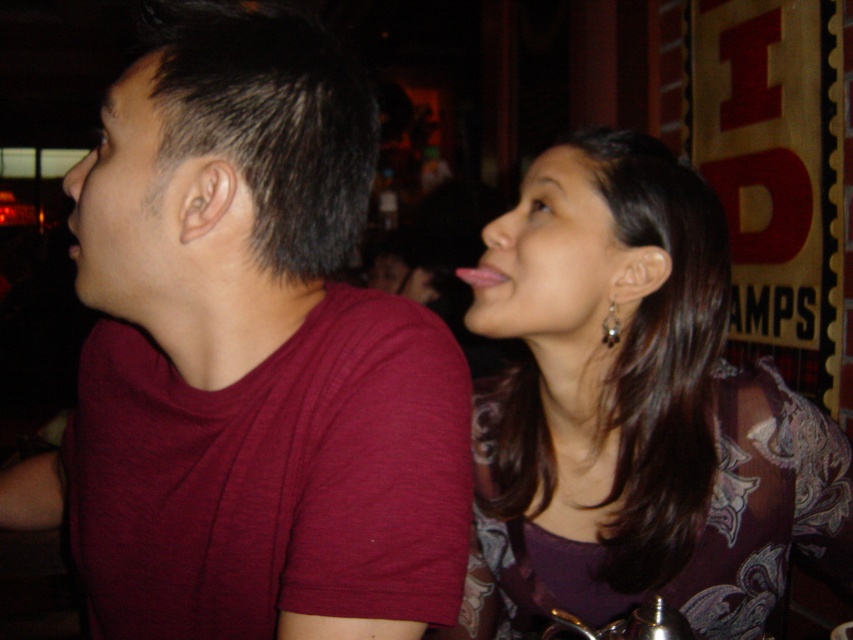
Question: Among these points, which one is farthest from the camera?

Choices:
 (A) click(x=602, y=330)
 (B) click(x=677, y=525)

Answer: (A)

Question: Which object is farther from the camera taking this photo?

Choices:
 (A) silver metallic earring at upper right
 (B) matte purple blouse at upper right
 (C) maroon t-shirt at left

Answer: (A)

Question: Which of the following is the closest to the observer?

Choices:
 (A) matte purple blouse at upper right
 (B) silver metallic earring at upper right

Answer: (A)

Question: Does maroon t-shirt at left have a smaller size compared to matte purple blouse at upper right?

Choices:
 (A) no
 (B) yes

Answer: (A)

Question: Does maroon t-shirt at left lie behind matte purple blouse at upper right?

Choices:
 (A) no
 (B) yes

Answer: (A)

Question: Is maroon t-shirt at left to the right of silver metallic earring at upper right from the viewer's perspective?

Choices:
 (A) yes
 (B) no

Answer: (B)